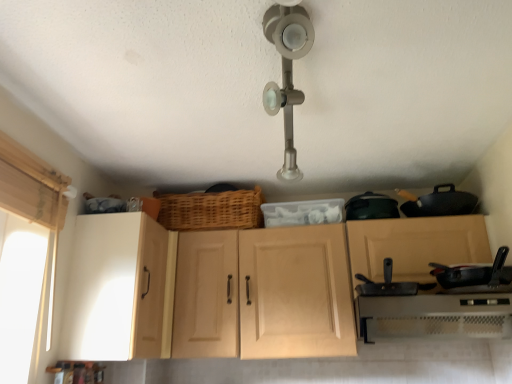
Question: Can we say black matte frying pan at lower right, placed as the 2th frying pan when sorted from left to right, lies outside white fabric at left?

Choices:
 (A) no
 (B) yes

Answer: (B)

Question: Is black matte frying pan at lower right, placed as the 2th frying pan when sorted from left to right, not near white fabric at left?

Choices:
 (A) no
 (B) yes

Answer: (B)

Question: Is black matte frying pan at lower right, placed as the 2th frying pan when sorted from left to right, positioned before white fabric at left?

Choices:
 (A) yes
 (B) no

Answer: (B)

Question: Is black matte frying pan at lower right, which ranks as the first frying pan in right-to-left order, at the right side of white fabric at left?

Choices:
 (A) no
 (B) yes

Answer: (B)

Question: Does black matte frying pan at lower right, placed as the 2th frying pan when sorted from left to right, turn towards white fabric at left?

Choices:
 (A) yes
 (B) no

Answer: (B)

Question: Does black matte frying pan at lower right, placed as the 2th frying pan when sorted from left to right, have a greater height compared to white fabric at left?

Choices:
 (A) yes
 (B) no

Answer: (B)

Question: Is the depth of black matte frying pan at center, which ranks as the first frying pan in left-to-right order, less than that of woven wood basket at center?

Choices:
 (A) yes
 (B) no

Answer: (A)

Question: Does black matte frying pan at center, which is counted as the second frying pan, starting from the right, have a smaller size compared to woven wood basket at center?

Choices:
 (A) no
 (B) yes

Answer: (B)

Question: Does black matte frying pan at center, which is counted as the second frying pan, starting from the right, appear on the right side of woven wood basket at center?

Choices:
 (A) no
 (B) yes

Answer: (B)

Question: From a real-world perspective, is black matte frying pan at center, which ranks as the first frying pan in left-to-right order, located beneath woven wood basket at center?

Choices:
 (A) no
 (B) yes

Answer: (B)

Question: From a real-world perspective, is black matte frying pan at center, which ranks as the first frying pan in left-to-right order, on top of woven wood basket at center?

Choices:
 (A) no
 (B) yes

Answer: (A)

Question: Is woven wood basket at center at the back of black matte frying pan at center, which is counted as the second frying pan, starting from the right?

Choices:
 (A) no
 (B) yes

Answer: (A)

Question: Could you tell me if white plastic oven at lower right is facing black matte frying pan at center, which is counted as the second frying pan, starting from the right?

Choices:
 (A) no
 (B) yes

Answer: (A)